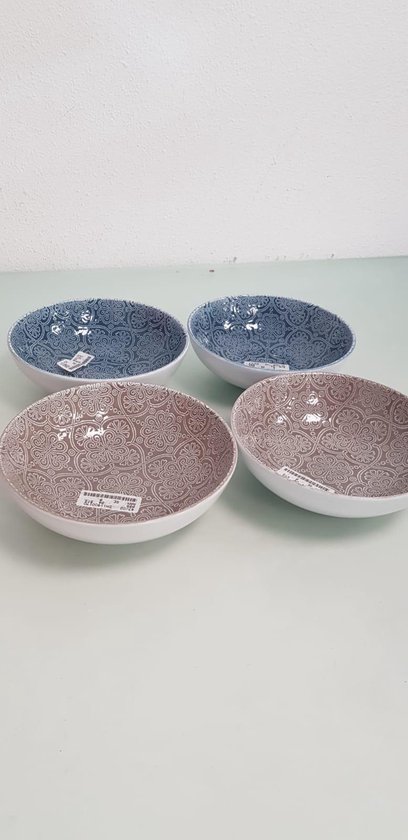
At what (x,y) coordinates should I click in order to perform the action: click on bowls. Please return your answer as a coordinate pair (x, y). The image size is (408, 840). Looking at the image, I should click on click(119, 371), click(262, 359), click(301, 439), click(144, 455).